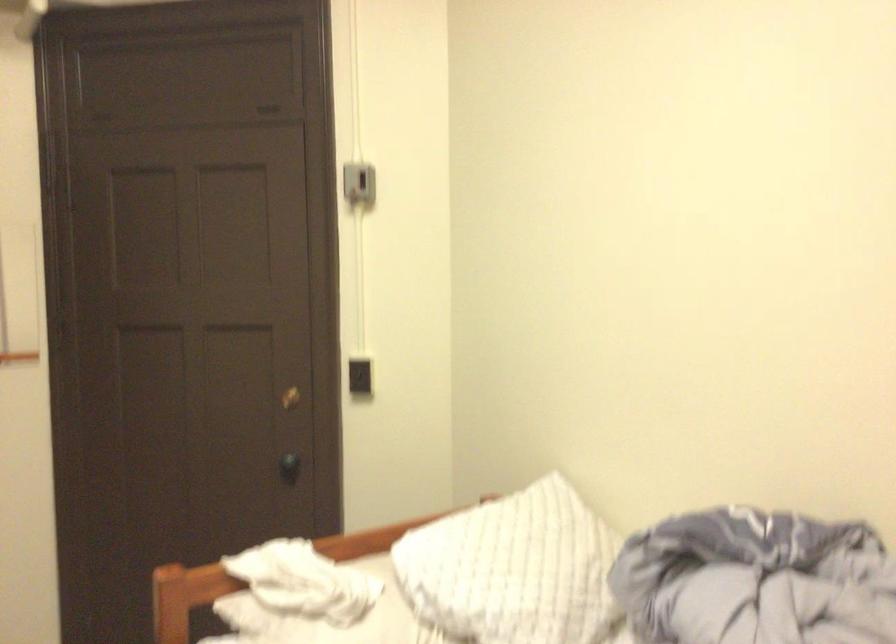
Identify the location of black light switch. The width and height of the screenshot is (896, 644). (359, 375).